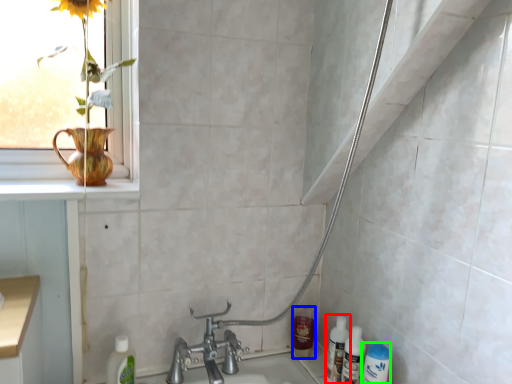
Question: Estimate the real-world distances between objects in this image. Which object is closer to bottle (highlighted by a red box), mouthwash (highlighted by a blue box) or mouthwash (highlighted by a green box)?

Choices:
 (A) mouthwash
 (B) mouthwash

Answer: (B)